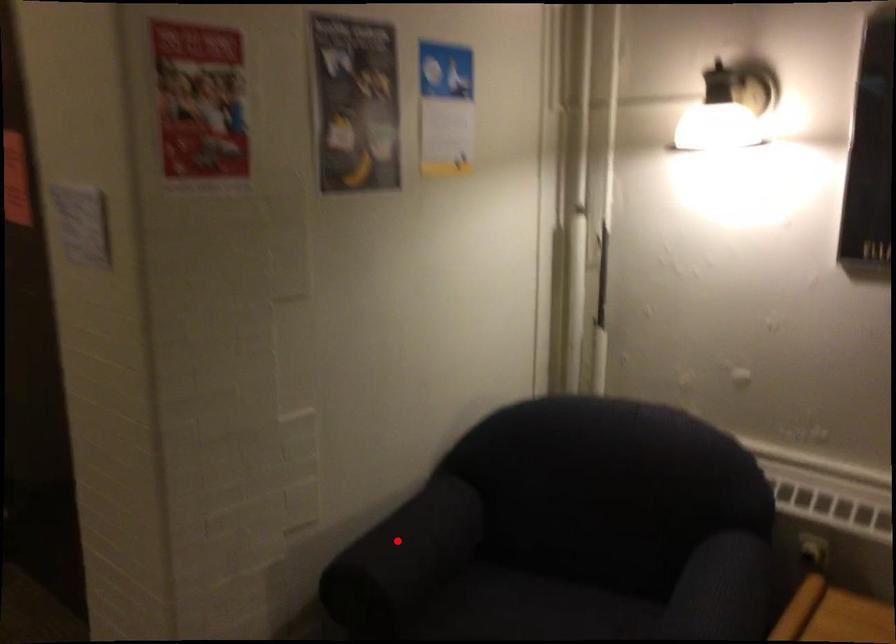
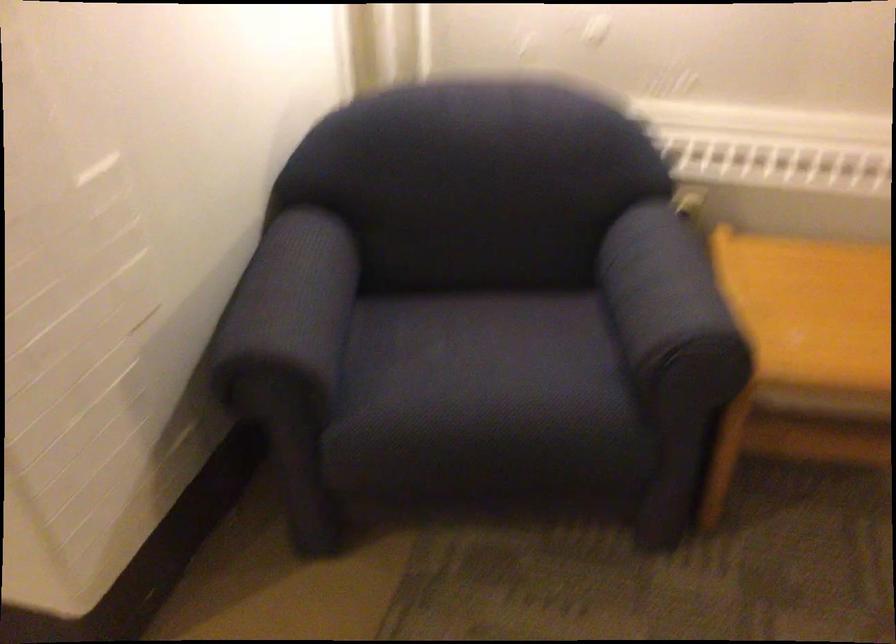
Question: I am providing you with two images of the same scene from different viewpoints. Given a red point in image1, look at the same physical point in image2. Is it:

Choices:
 (A) Closer to the viewpoint
 (B) Farther from the viewpoint

Answer: (A)